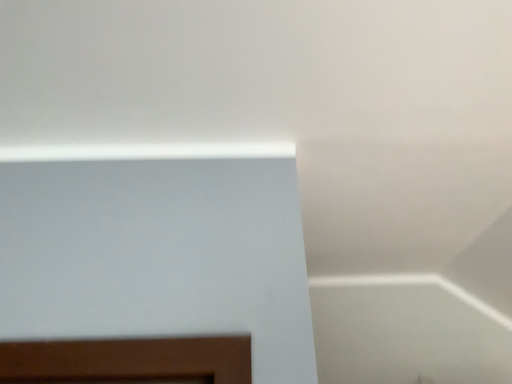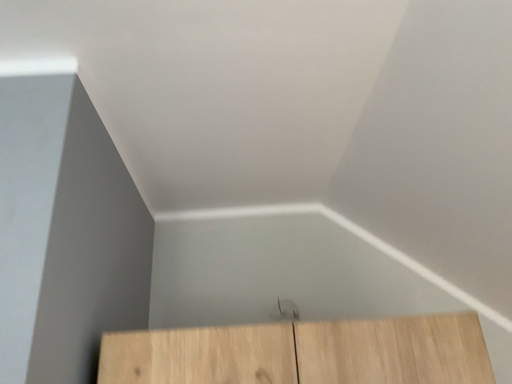
Question: How did the camera likely rotate when shooting the video?

Choices:
 (A) rotated downward
 (B) rotated upward

Answer: (A)